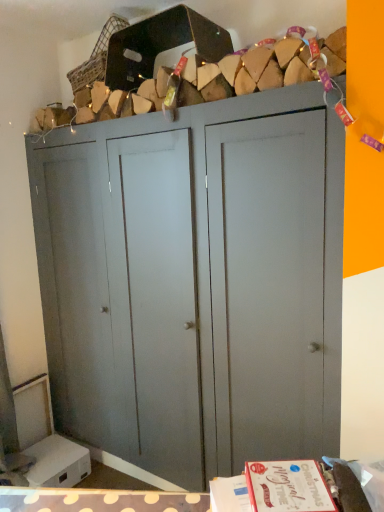
Question: Relative to woven fabric basket at upper center, is matte gray cupboard at center in front or behind?

Choices:
 (A) behind
 (B) front

Answer: (B)

Question: From a real-world perspective, is matte gray cupboard at center physically located above or below woven fabric basket at upper center?

Choices:
 (A) above
 (B) below

Answer: (B)

Question: Looking at the image, does matte gray cupboard at center seem bigger or smaller compared to woven fabric basket at upper center?

Choices:
 (A) small
 (B) big

Answer: (B)

Question: Considering the positions of woven fabric basket at upper center and matte gray cupboard at center in the image, is woven fabric basket at upper center bigger or smaller than matte gray cupboard at center?

Choices:
 (A) small
 (B) big

Answer: (A)

Question: In terms of height, does woven fabric basket at upper center look taller or shorter compared to matte gray cupboard at center?

Choices:
 (A) short
 (B) tall

Answer: (A)

Question: From the image's perspective, relative to matte gray cupboard at center, is woven fabric basket at upper center above or below?

Choices:
 (A) below
 (B) above

Answer: (B)

Question: Is woven fabric basket at upper center to the left or to the right of matte gray cupboard at center in the image?

Choices:
 (A) right
 (B) left

Answer: (B)